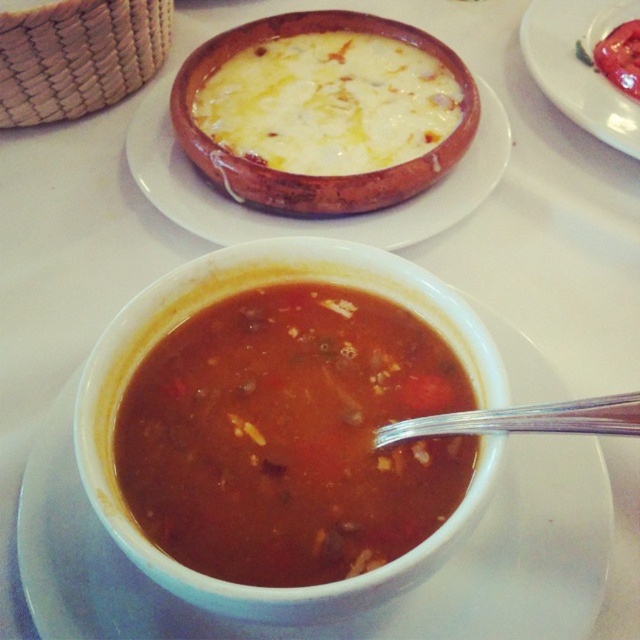
Question: Which of the following is the farthest from the observer?

Choices:
 (A) (524, 56)
 (B) (624, 65)
 (C) (504, 378)

Answer: (A)

Question: Is matte clay bowl at upper center thinner than tomato matte at upper right?

Choices:
 (A) yes
 (B) no

Answer: (B)

Question: Which point is closer to the camera?

Choices:
 (A) matte clay bowl at upper center
 (B) white creamy soup at upper center
 (C) tomato matte at upper right
 (D) tomato paste at upper right

Answer: (A)

Question: Where is matte clay bowl at upper center located in relation to tomato matte at upper right in the image?

Choices:
 (A) right
 (B) left

Answer: (B)

Question: Which point is farther from the camera taking this photo?

Choices:
 (A) (547, 36)
 (B) (161, 122)

Answer: (A)

Question: Does white creamy soup at upper center have a larger size compared to matte clay bowl at upper center?

Choices:
 (A) no
 (B) yes

Answer: (A)